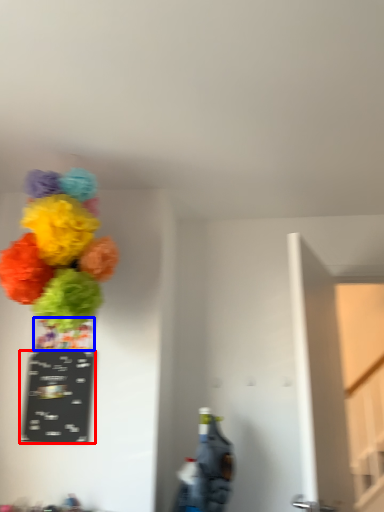
Question: Which object is further to the camera taking this photo, writing (highlighted by a red box) or vase (highlighted by a blue box)?

Choices:
 (A) writing
 (B) vase

Answer: (B)